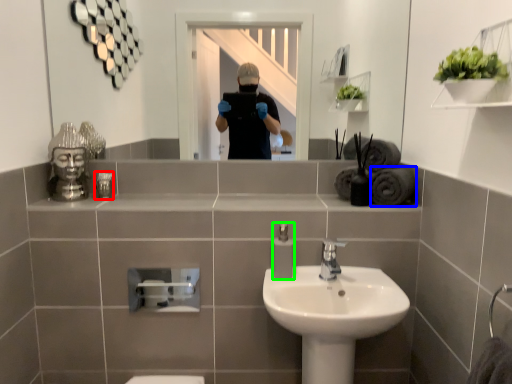
Question: Considering the real-world distances, which object is farthest from toiletry (highlighted by a red box)? bath towel (highlighted by a blue box) or soap dispenser (highlighted by a green box)?

Choices:
 (A) bath towel
 (B) soap dispenser

Answer: (A)